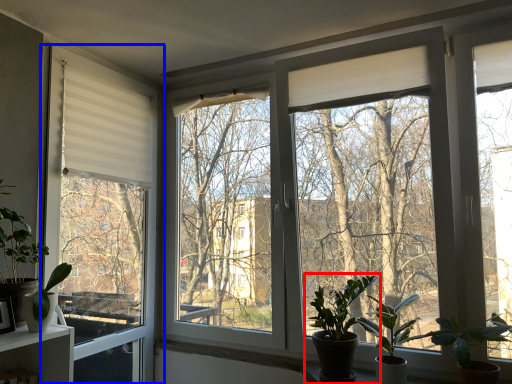
Question: Which of the following is the farthest to the observer, houseplant (highlighted by a red box) or window (highlighted by a blue box)?

Choices:
 (A) houseplant
 (B) window

Answer: (B)